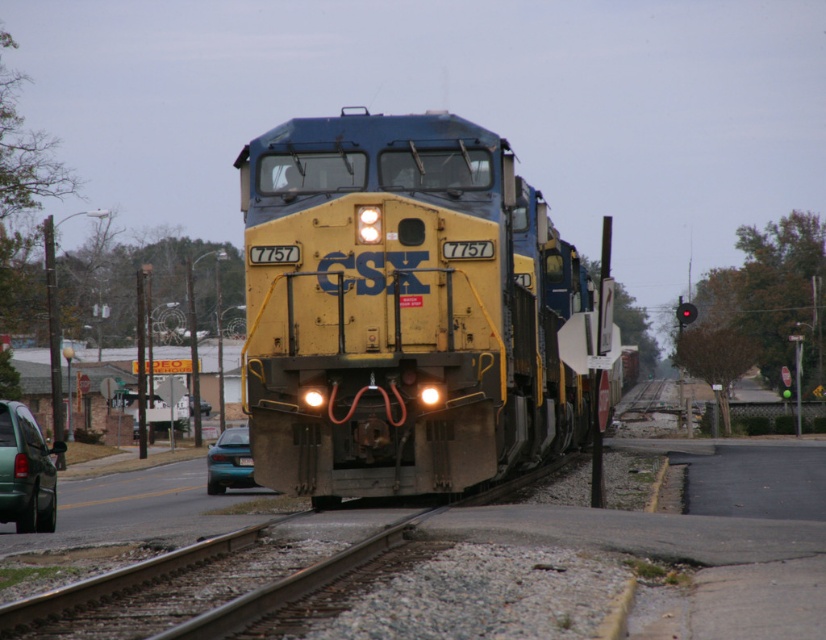
Is yellow matte locomotive at center taller than teal glossy car at lower left?

Correct, yellow matte locomotive at center is much taller as teal glossy car at lower left.

Is point (359, 246) positioned in front of point (243, 467)?

Yes, it is.

Is point (400, 241) positioned behind point (233, 456)?

No, it is not.

You are a GUI agent. You are given a task and a screenshot of the screen. Output one action in this format:
    pyautogui.click(x=<x>, y=<y>)
    Task: Click on the yellow matte locomotive at center
    
    Given the screenshot: What is the action you would take?
    pyautogui.click(x=402, y=308)

Is green matte van at lower left positioned behind teal glossy car at lower left?

No, it is not.

Does point (46, 470) lie in front of point (225, 468)?

Yes, point (46, 470) is closer to viewer.

Find the location of a particular element. green matte van at lower left is located at coordinates (25, 470).

From the picture: Does yellow matte locomotive at center have a larger size compared to green matte van at lower left?

Yes, yellow matte locomotive at center is bigger than green matte van at lower left.

Is yellow matte locomotive at center wider than green matte van at lower left?

Yes.

Which is behind, point (425, 124) or point (13, 403)?

Point (13, 403)

Where is `yellow matte locomotive at center`? The height and width of the screenshot is (640, 826). yellow matte locomotive at center is located at coordinates (402, 308).